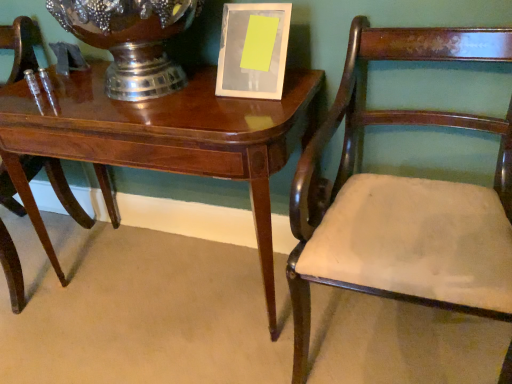
You are a GUI agent. You are given a task and a screenshot of the screen. Output one action in this format:
    pyautogui.click(x=<x>, y=<y>)
    Task: Click on the free area in between glossy wood table at center and mahogany wood chair at right, positioned as the first chair in right-to-left order
    
    Given the screenshot: What is the action you would take?
    pyautogui.click(x=189, y=343)